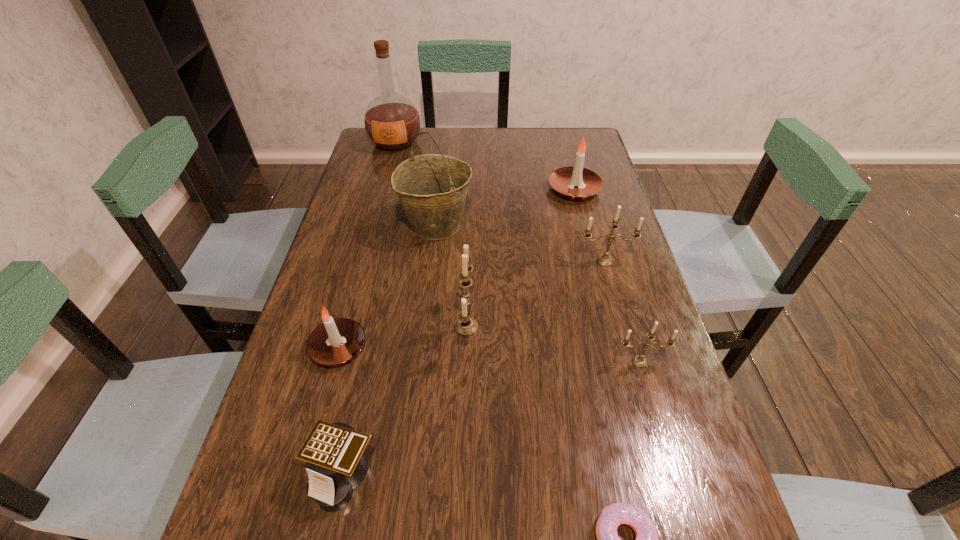
I want to click on the farthest object, so click(x=391, y=120).

Identify the location of pink liquor. This screenshot has height=540, width=960. (391, 120).

Image resolution: width=960 pixels, height=540 pixels. I want to click on wine bucket, so click(432, 188).

Identify the location of the tallest candle. The image size is (960, 540). (466, 326).

Locate an element on the screen. Image resolution: width=960 pixels, height=540 pixels. the second candle from left to right is located at coordinates (466, 326).

Find the location of a particular element. The height and width of the screenshot is (540, 960). the bigger white candle is located at coordinates (565, 180).

At what (x,y) coordinates should I click in order to perform the action: click on the farther white candle. Please return your answer as a coordinate pair (x, y). Looking at the image, I should click on (565, 180).

This screenshot has height=540, width=960. I want to click on the sixth nearest object, so click(605, 260).

Where is `the farthest metallic candle`? The width and height of the screenshot is (960, 540). the farthest metallic candle is located at coordinates (605, 260).

Find the location of `the leftmost candle`. the leftmost candle is located at coordinates (335, 341).